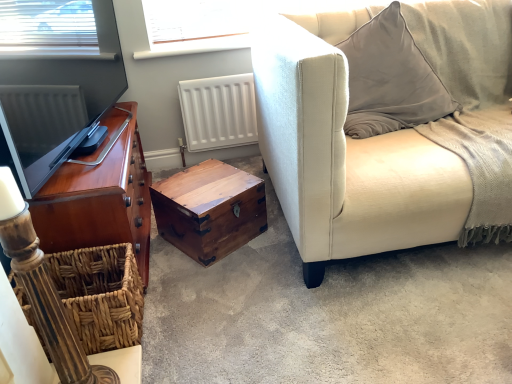
Question: Can you confirm if woven brown basket at lower left is wider than shiny brown wood cabinet at left?

Choices:
 (A) no
 (B) yes

Answer: (B)

Question: Considering the relative positions of woven brown basket at lower left and shiny brown wood cabinet at left in the image provided, is woven brown basket at lower left to the left of shiny brown wood cabinet at left from the viewer's perspective?

Choices:
 (A) no
 (B) yes

Answer: (A)

Question: Is woven brown basket at lower left further to the viewer compared to shiny brown wood cabinet at left?

Choices:
 (A) no
 (B) yes

Answer: (A)

Question: Does woven brown basket at lower left have a greater height compared to shiny brown wood cabinet at left?

Choices:
 (A) no
 (B) yes

Answer: (A)

Question: From a real-world perspective, is woven brown basket at lower left positioned under shiny brown wood cabinet at left based on gravity?

Choices:
 (A) yes
 (B) no

Answer: (A)

Question: From a real-world perspective, is woven brown basket at lower left physically located above or below shiny brown wood cabinet at left?

Choices:
 (A) below
 (B) above

Answer: (A)

Question: Is woven brown basket at lower left wider or thinner than shiny brown wood cabinet at left?

Choices:
 (A) thin
 (B) wide

Answer: (B)

Question: Considering the positions of woven brown basket at lower left and shiny brown wood cabinet at left in the image, is woven brown basket at lower left bigger or smaller than shiny brown wood cabinet at left?

Choices:
 (A) big
 (B) small

Answer: (B)

Question: In the image, is woven brown basket at lower left positioned in front of or behind shiny brown wood cabinet at left?

Choices:
 (A) front
 (B) behind

Answer: (A)

Question: Is suede beige couch at right taller or shorter than woven brown basket at lower left?

Choices:
 (A) tall
 (B) short

Answer: (A)

Question: Based on their sizes in the image, would you say suede beige couch at right is bigger or smaller than woven brown basket at lower left?

Choices:
 (A) big
 (B) small

Answer: (A)

Question: From the image's perspective, is suede beige couch at right above or below woven brown basket at lower left?

Choices:
 (A) below
 (B) above

Answer: (B)

Question: From a real-world perspective, is suede beige couch at right positioned above or below woven brown basket at lower left?

Choices:
 (A) below
 (B) above

Answer: (B)

Question: From a real-world perspective, relative to suede beige couch at right, is woven brown basket at lower left vertically above or below?

Choices:
 (A) below
 (B) above

Answer: (A)

Question: Looking at the image, does woven brown basket at lower left seem bigger or smaller compared to suede beige couch at right?

Choices:
 (A) big
 (B) small

Answer: (B)